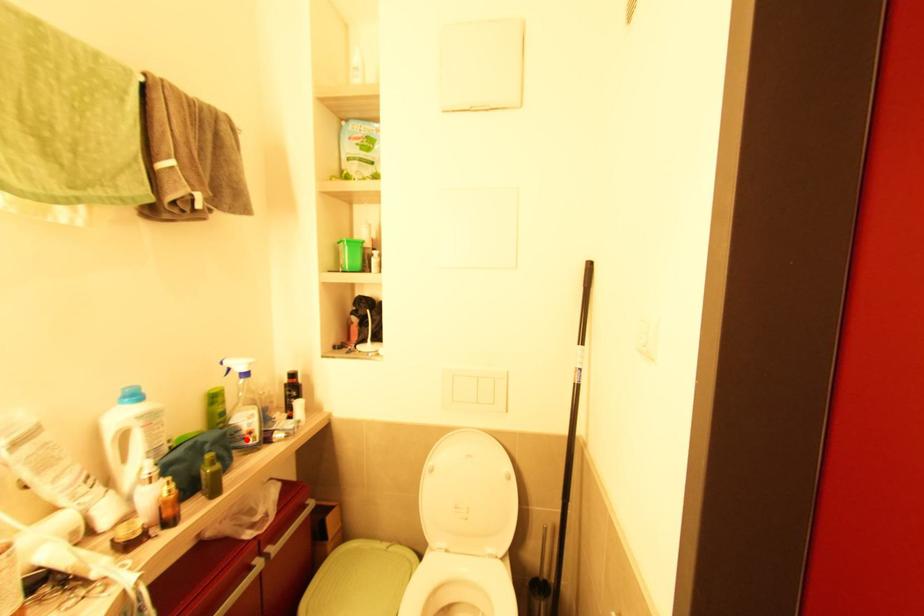
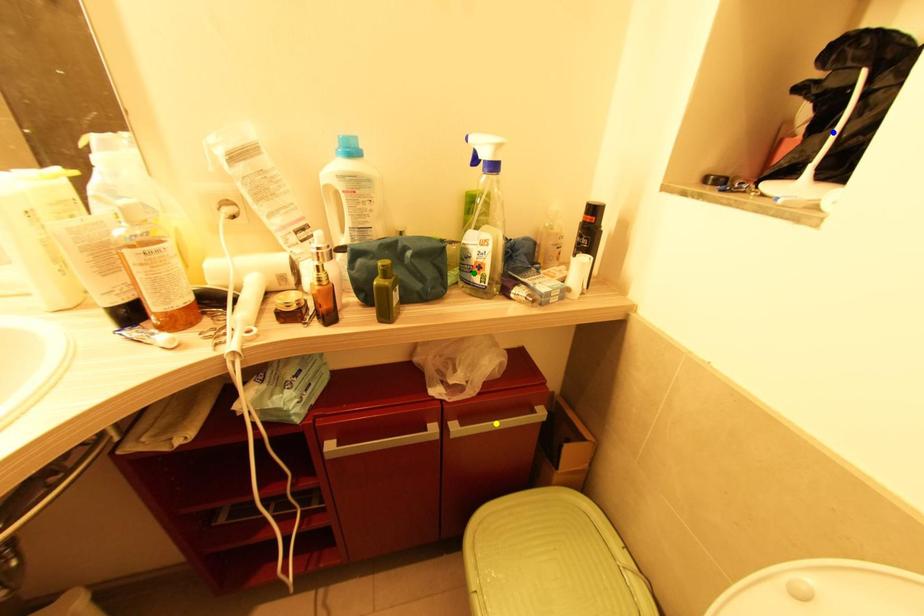
Question: I am providing you with two images of the same scene from different viewpoints. A red point is marked on the first image. You are given multiple points on the second image. Can you choose the point in image 2 that corresponds to the point in image 1?

Choices:
 (A) yellow point
 (B) green point
 (C) blue point

Answer: (B)